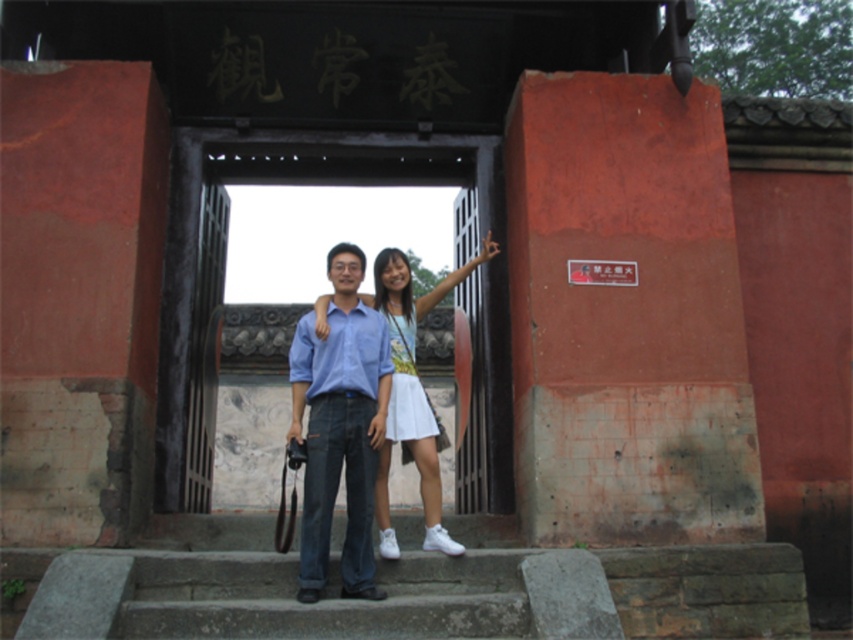
Is wooden gate at center to the left of white cotton dress at center from the viewer's perspective?

Indeed, wooden gate at center is positioned on the left side of white cotton dress at center.

Is wooden gate at center thinner than white cotton dress at center?

Incorrect, wooden gate at center's width is not less than white cotton dress at center's.

The width and height of the screenshot is (853, 640). What are the coordinates of `wooden gate at center` in the screenshot? It's located at (225, 250).

Who is more forward, (212, 276) or (373, 449)?

Point (373, 449) is more forward.

Is point (213, 216) in front of point (384, 419)?

No, it is behind (384, 419).

Who is more distant from viewer, (503, 332) or (338, 387)?

The point (503, 332) is behind.

You are a GUI agent. You are given a task and a screenshot of the screen. Output one action in this format:
    pyautogui.click(x=<x>, y=<y>)
    Task: Click on the wooden gate at center
    The image size is (853, 640).
    Given the screenshot: What is the action you would take?
    pyautogui.click(x=225, y=250)

Which is above, blue denim jeans at center or white cotton dress at center?

white cotton dress at center

Who is more forward, (315,554) or (386,284)?

Point (315,554)

I want to click on blue denim jeans at center, so click(x=340, y=428).